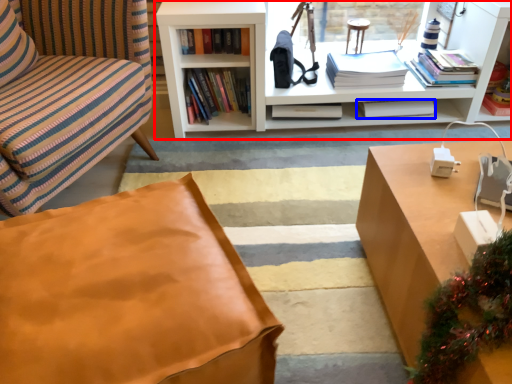
Question: Which point is further to the camera, bookcase (highlighted by a red box) or book (highlighted by a blue box)?

Choices:
 (A) bookcase
 (B) book

Answer: (B)